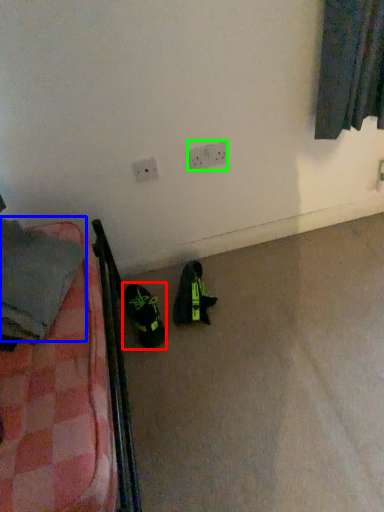
Question: Which is nearer to the footwear (highlighted by a red box)? clothing (highlighted by a blue box) or electric outlet (highlighted by a green box).

Choices:
 (A) clothing
 (B) electric outlet

Answer: (A)